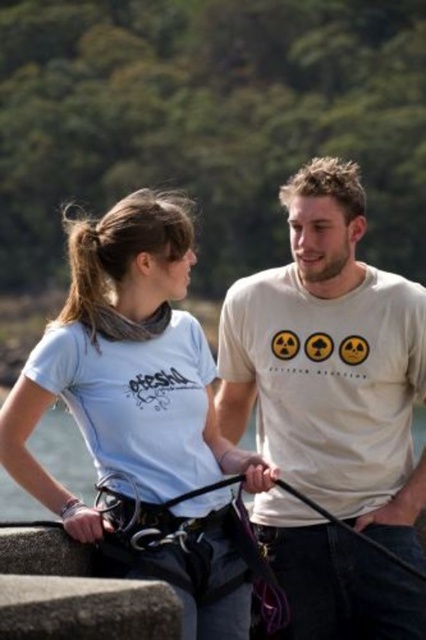
Question: Among these objects, which one is nearest to the camera?

Choices:
 (A) white matte t-shirt at center
 (B) light blue fabric shirt at left

Answer: (B)

Question: Can you confirm if white matte t-shirt at center is bigger than light blue fabric shirt at left?

Choices:
 (A) yes
 (B) no

Answer: (B)

Question: Which point is closer to the camera?

Choices:
 (A) (345, 636)
 (B) (54, 364)

Answer: (B)

Question: Can you confirm if white matte t-shirt at center is wider than light blue fabric shirt at left?

Choices:
 (A) no
 (B) yes

Answer: (A)

Question: Is white matte t-shirt at center smaller than light blue fabric shirt at left?

Choices:
 (A) yes
 (B) no

Answer: (A)